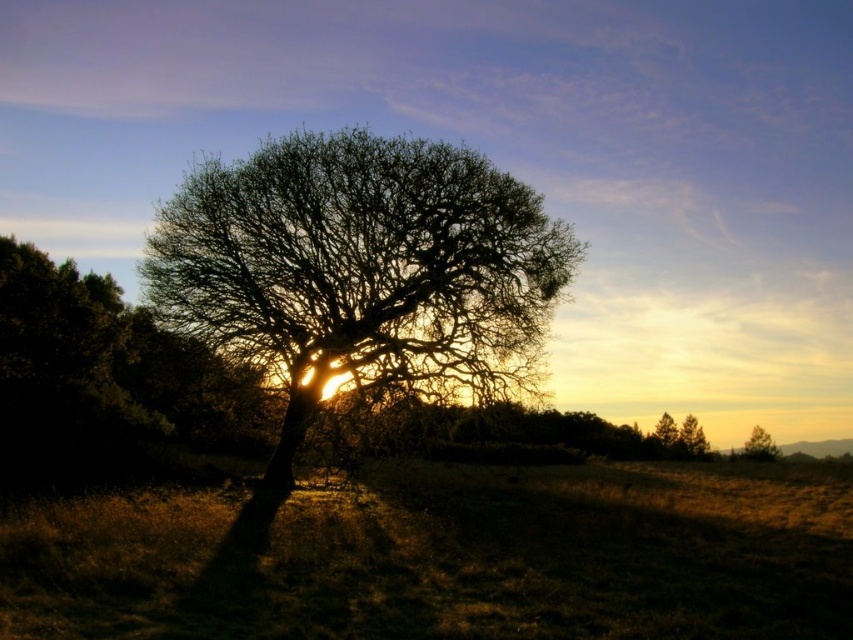
Is green matte tree at upper right to the left of green matte tree at lower right from the viewer's perspective?

Indeed, green matte tree at upper right is positioned on the left side of green matte tree at lower right.

Consider the image. Who is positioned more to the left, green matte tree at upper right or green matte tree at lower right?

From the viewer's perspective, green matte tree at upper right appears more on the left side.

The image size is (853, 640). In order to click on green matte tree at upper right in this screenshot , I will do `click(692, 436)`.

Between point (335, 164) and point (701, 451), which one is positioned behind?

Point (701, 451)

Between point (230, 280) and point (695, 445), which one is positioned behind?

Positioned behind is point (695, 445).

Image resolution: width=853 pixels, height=640 pixels. What are the coordinates of `silhouette leafy tree at center` in the screenshot? It's located at (361, 269).

Does brown grass at center appear under silhouette leafy tree at center?

Correct, brown grass at center is located below silhouette leafy tree at center.

Can you confirm if brown grass at center is positioned to the left of silhouette leafy tree at center?

No, brown grass at center is not to the left of silhouette leafy tree at center.

Between point (486, 595) and point (408, 344), which one is positioned in front?

Point (486, 595) is more forward.

Locate an element on the screen. brown grass at center is located at coordinates (447, 557).